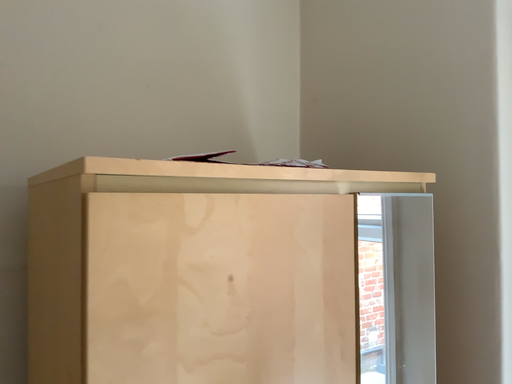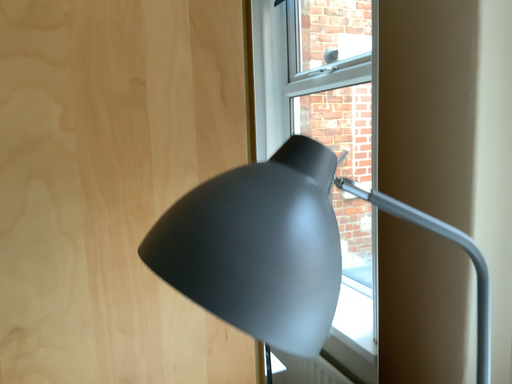
Question: Which way did the camera rotate in the video?

Choices:
 (A) rotated downward
 (B) rotated upward

Answer: (A)